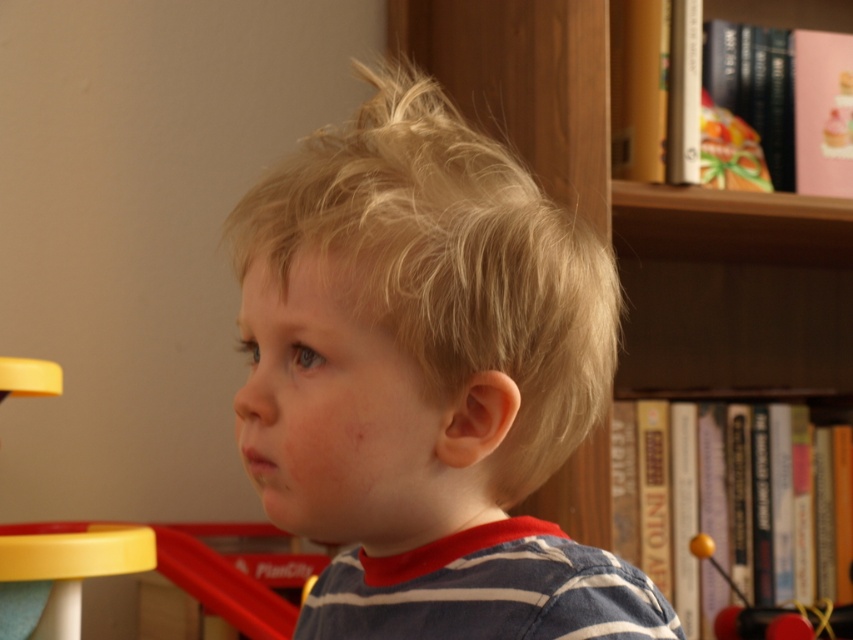
The height and width of the screenshot is (640, 853). What do you see at coordinates (427, 380) in the screenshot?
I see `blonde hair at center` at bounding box center [427, 380].

Is point (514, 394) closer to viewer compared to point (561, 492)?

Yes.

You are a GUI agent. You are given a task and a screenshot of the screen. Output one action in this format:
    pyautogui.click(x=<x>, y=<y>)
    Task: Click on the blonde hair at center
    This screenshot has height=640, width=853.
    Given the screenshot: What is the action you would take?
    pyautogui.click(x=427, y=380)

Who is taller, blonde hair at center or yellow rubber ball at right?

Standing taller between the two is blonde hair at center.

Looking at this image, can you confirm if blonde hair at center is thinner than yellow rubber ball at right?

In fact, blonde hair at center might be wider than yellow rubber ball at right.

Which is in front, point (241, 442) or point (746, 627)?

Point (241, 442)

The width and height of the screenshot is (853, 640). Find the location of `blonde hair at center`. blonde hair at center is located at coordinates (427, 380).

Can you confirm if wooden bookshelf at upper right is positioned below yellow rubber ball at right?

No.

Consider the image. Which of these two, wooden bookshelf at upper right or yellow rubber ball at right, stands shorter?

yellow rubber ball at right

The height and width of the screenshot is (640, 853). Identify the location of wooden bookshelf at upper right. (653, 212).

Identify the location of wooden bookshelf at upper right. (653, 212).